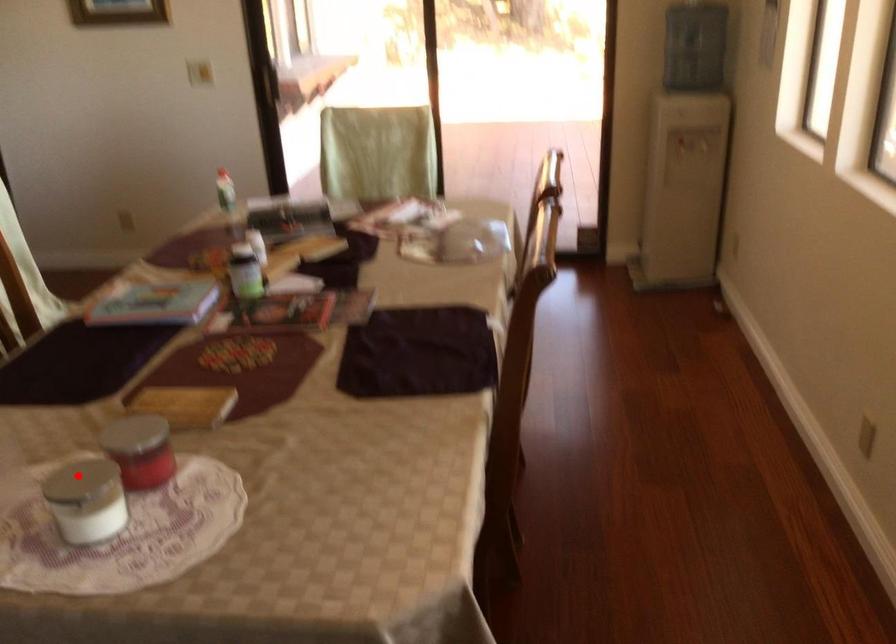
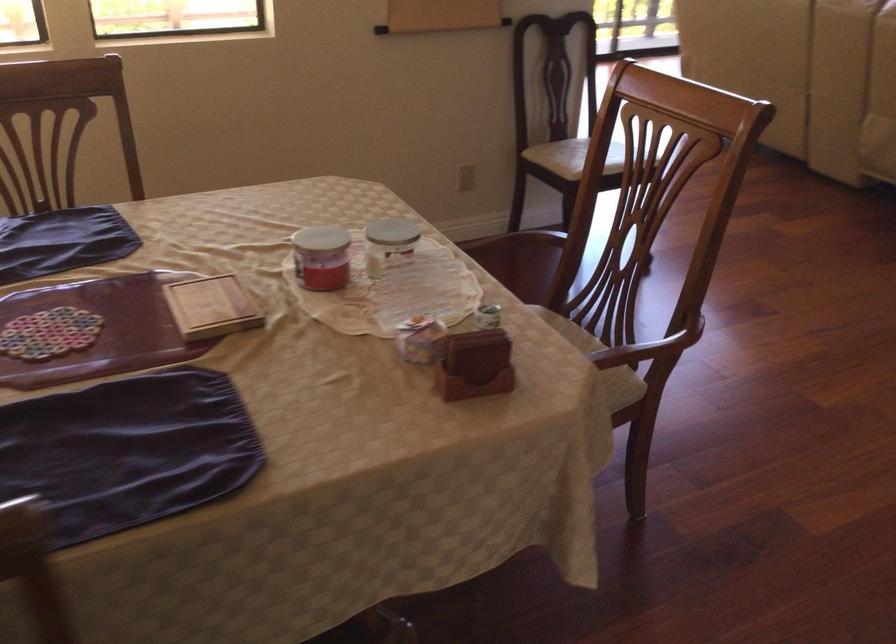
Where in the second image is the point corresponding to the highlighted location from the first image?

(389, 243)